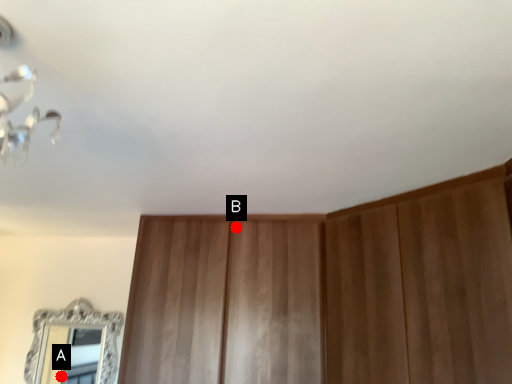
Question: Two points are circled on the image, labeled by A and B beside each circle. Which of the following is the farthest from the observer?

Choices:
 (A) A is further
 (B) B is further

Answer: (A)